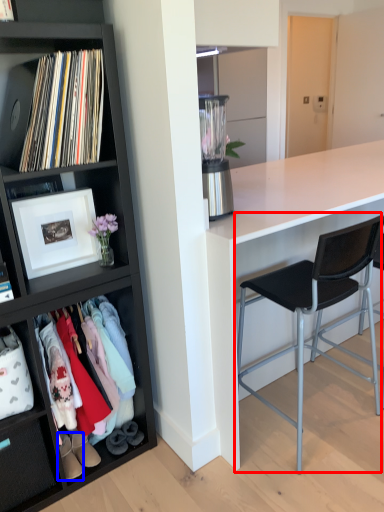
Question: Which of the following is the closest to the observer, chair (highlighted by a red box) or footwear (highlighted by a blue box)?

Choices:
 (A) chair
 (B) footwear

Answer: (A)